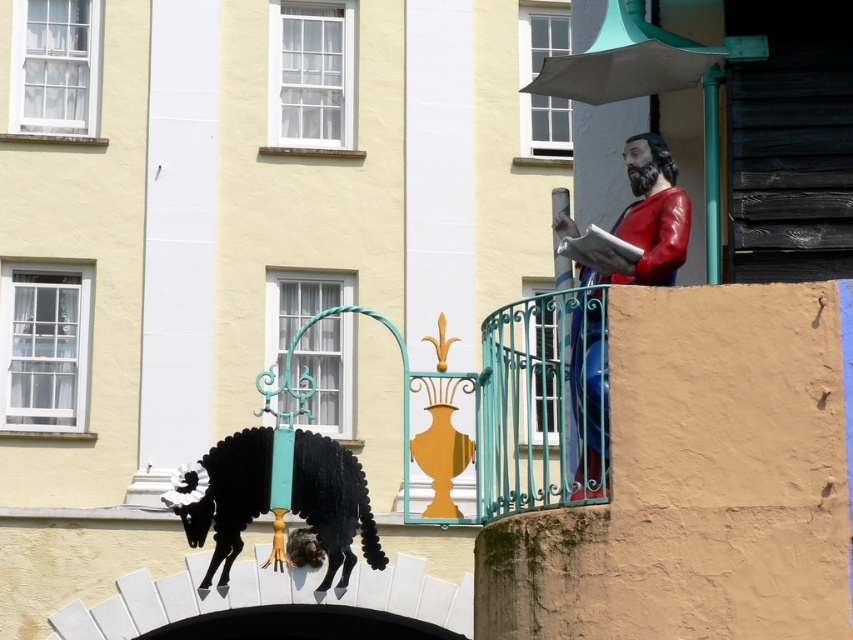
Consider the image. Who is positioned more to the right, black matte ram at lower left or shiny red statue at upper right?

From the viewer's perspective, shiny red statue at upper right appears more on the right side.

Image resolution: width=853 pixels, height=640 pixels. I want to click on black matte ram at lower left, so click(329, 508).